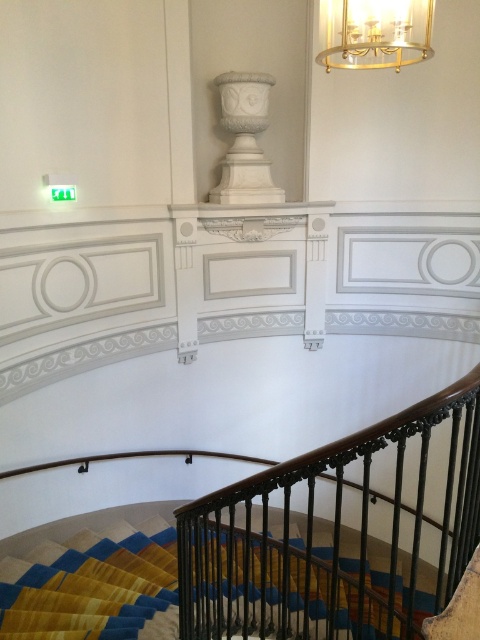
Who is positioned more to the left, black wrought iron railing at center or white marble urn at upper center?

From the viewer's perspective, white marble urn at upper center appears more on the left side.

Does black wrought iron railing at center have a lesser width compared to white marble urn at upper center?

No.

Where is `black wrought iron railing at center`? The height and width of the screenshot is (640, 480). black wrought iron railing at center is located at coordinates point(339,536).

Which is more to the right, multicolored carpeted stairs at lower center or gold metallic chandelier at upper center?

gold metallic chandelier at upper center is more to the right.

Can you confirm if multicolored carpeted stairs at lower center is wider than gold metallic chandelier at upper center?

Yes, multicolored carpeted stairs at lower center is wider than gold metallic chandelier at upper center.

Is point (62, 536) positioned before point (419, 4)?

No.

You are a GUI agent. You are given a task and a screenshot of the screen. Output one action in this format:
    pyautogui.click(x=<x>, y=<y>)
    Task: Click on the multicolored carpeted stairs at lower center
    
    Given the screenshot: What is the action you would take?
    pyautogui.click(x=92, y=577)

Measure the distance between point (324, 0) and camera.

The distance of point (324, 0) from camera is 6.79 feet.

Which is below, gold metallic chandelier at upper center or white marble urn at upper center?

gold metallic chandelier at upper center is lower down.

Which is in front, point (354, 12) or point (265, 160)?

Point (354, 12) is in front.

This screenshot has width=480, height=640. Identify the location of gold metallic chandelier at upper center. (373, 33).